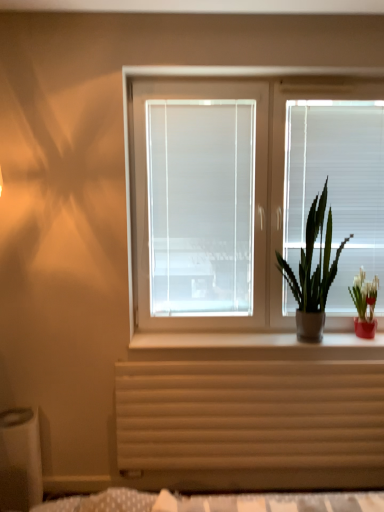
Locate an element on the screen. The width and height of the screenshot is (384, 512). vacant space situated above wooden radiator at lower center (from a real-world perspective) is located at coordinates (265, 357).